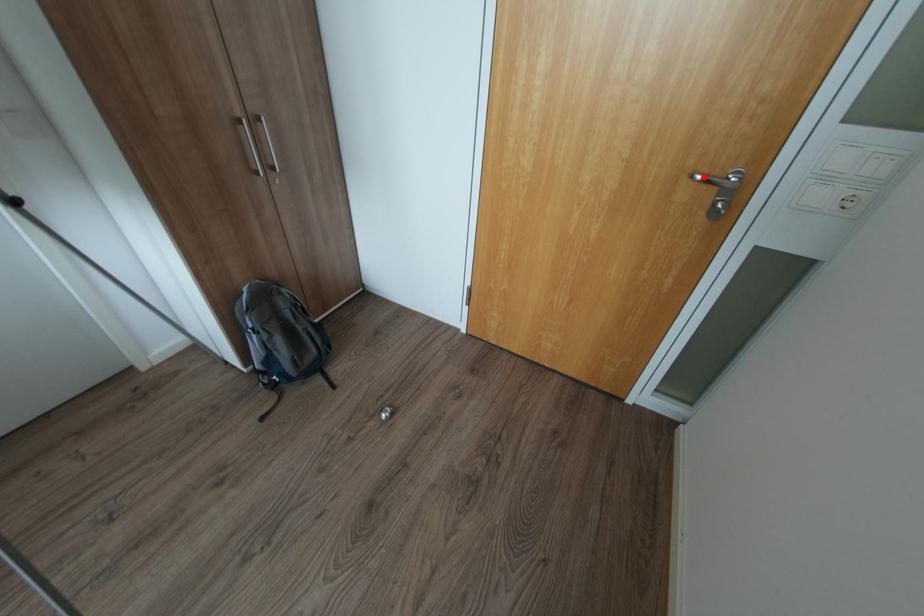
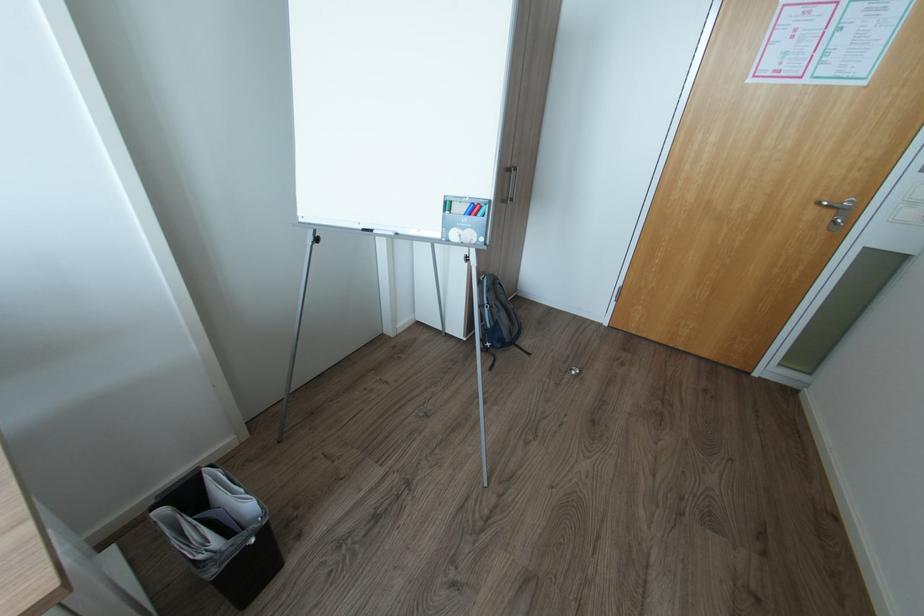
Where in the second image is the point corresponding to the highlighted location from the first image?

(830, 204)